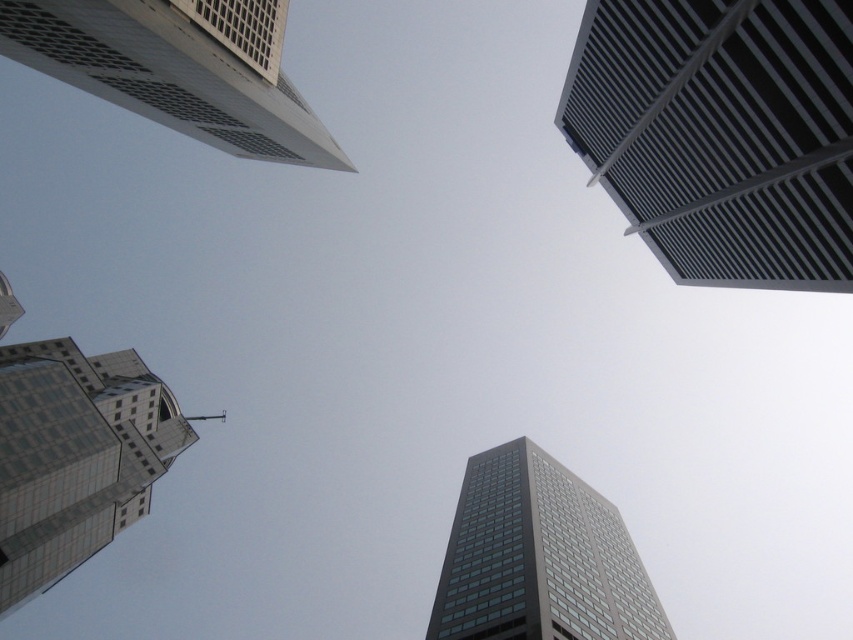
Which of these two, metallic gray building at upper right or white textured building at upper left, stands taller?

metallic gray building at upper right is taller.

Between point (711, 188) and point (35, 1), which one is positioned in front?

Positioned in front is point (35, 1).

You are a GUI agent. You are given a task and a screenshot of the screen. Output one action in this format:
    pyautogui.click(x=<x>, y=<y>)
    Task: Click on the metallic gray building at upper right
    The width and height of the screenshot is (853, 640).
    Given the screenshot: What is the action you would take?
    pyautogui.click(x=721, y=132)

Measure the distance from white textured building at upper left to dark gray glass skyscraper at center.

The distance of white textured building at upper left from dark gray glass skyscraper at center is 76.73 meters.

This screenshot has height=640, width=853. Find the location of `white textured building at upper left`. white textured building at upper left is located at coordinates (178, 68).

This screenshot has width=853, height=640. What do you see at coordinates (721, 132) in the screenshot? I see `metallic gray building at upper right` at bounding box center [721, 132].

Which is behind, point (585, 147) or point (502, 445)?

Positioned behind is point (502, 445).

Identify the location of metallic gray building at upper right. (721, 132).